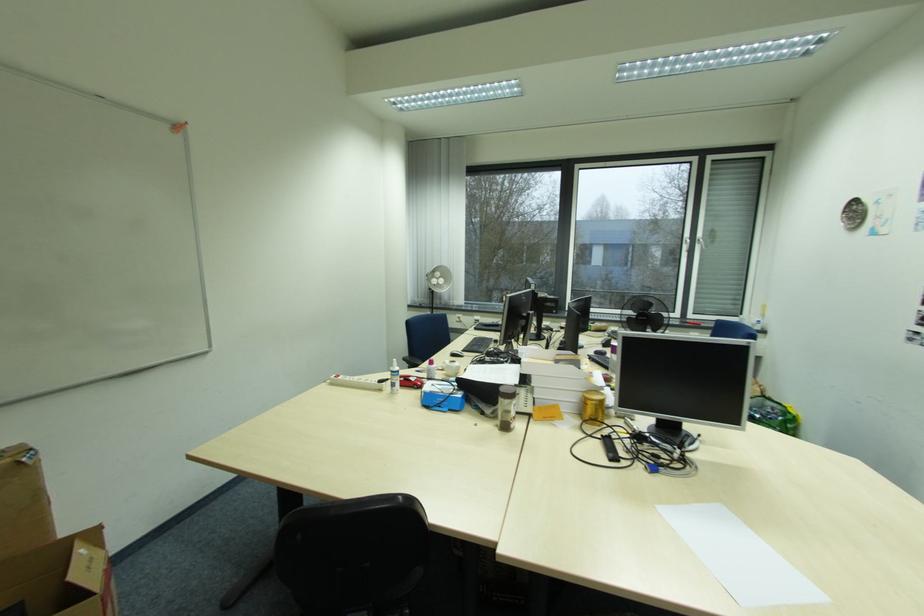
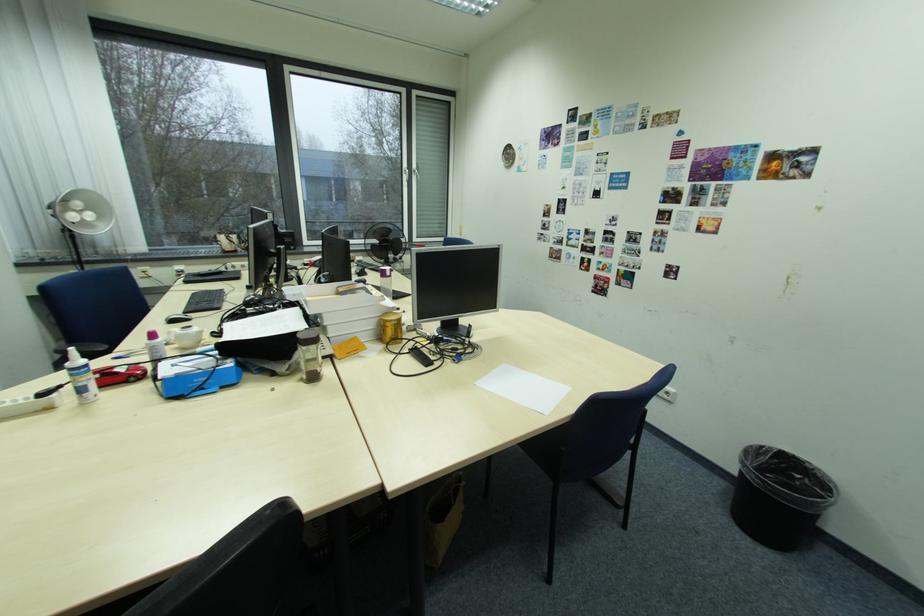
Where in the second image is the point corresponding to point 460,355 from the first image?

(180, 322)